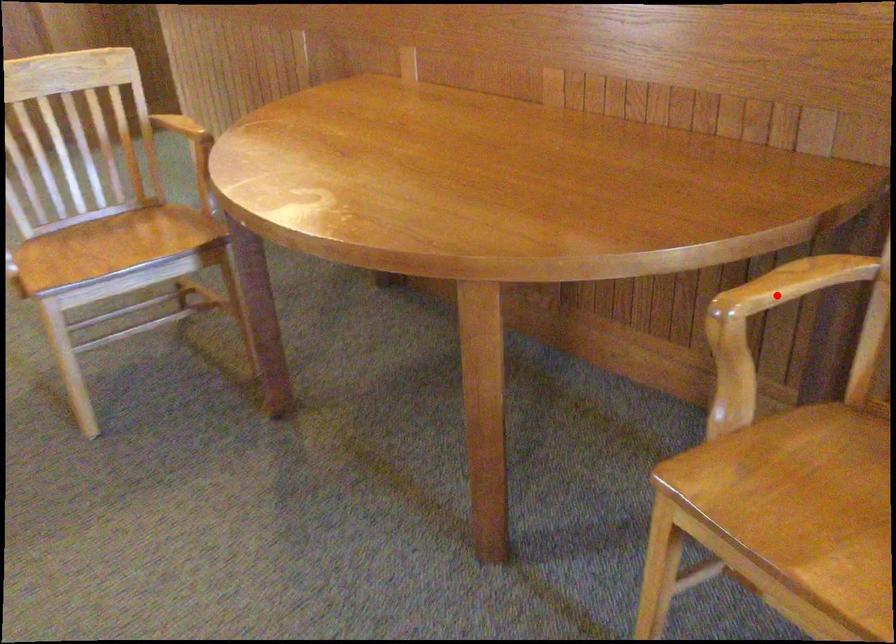
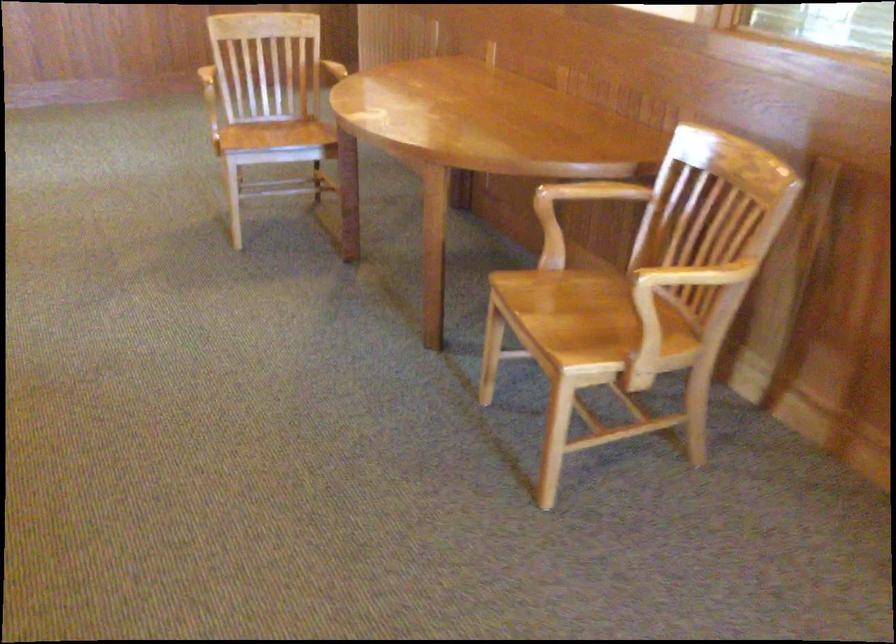
Question: I am providing you with two images of the same scene from different viewpoints. A red point is shown in image1. For the corresponding object point in image2, is it positioned nearer or farther from the camera?

Choices:
 (A) Nearer
 (B) Farther

Answer: (B)